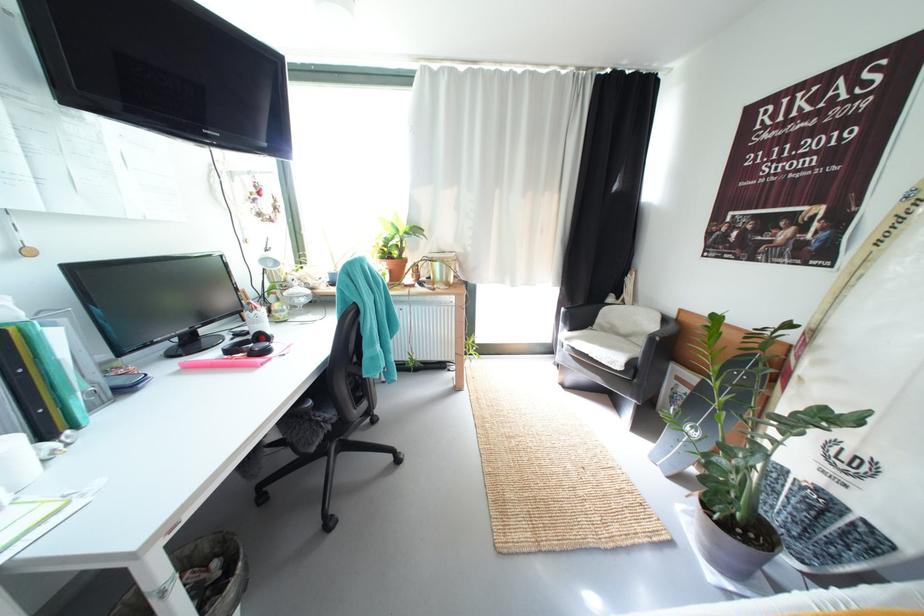
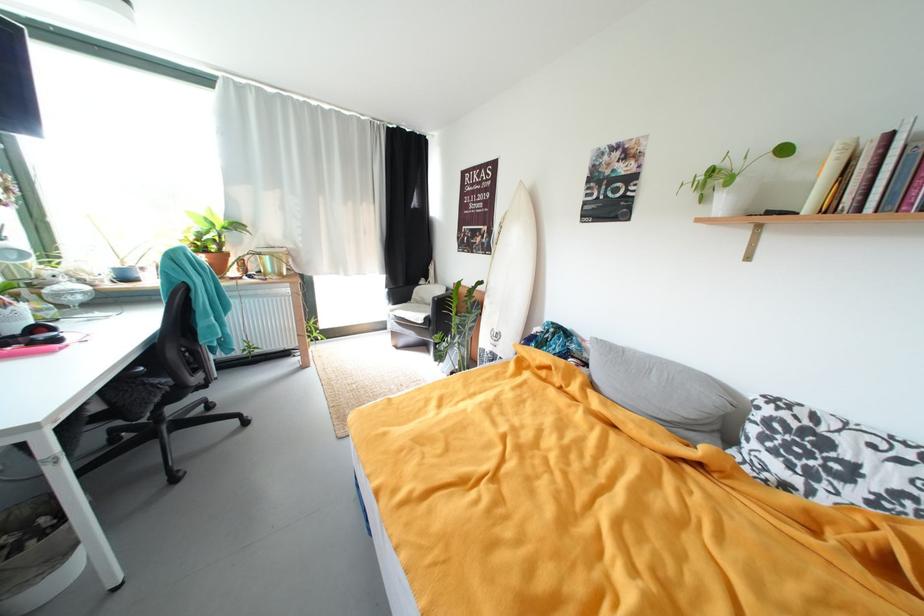
Locate, in the second image, the point that corresponds to (452,251) in the first image.

(281, 246)